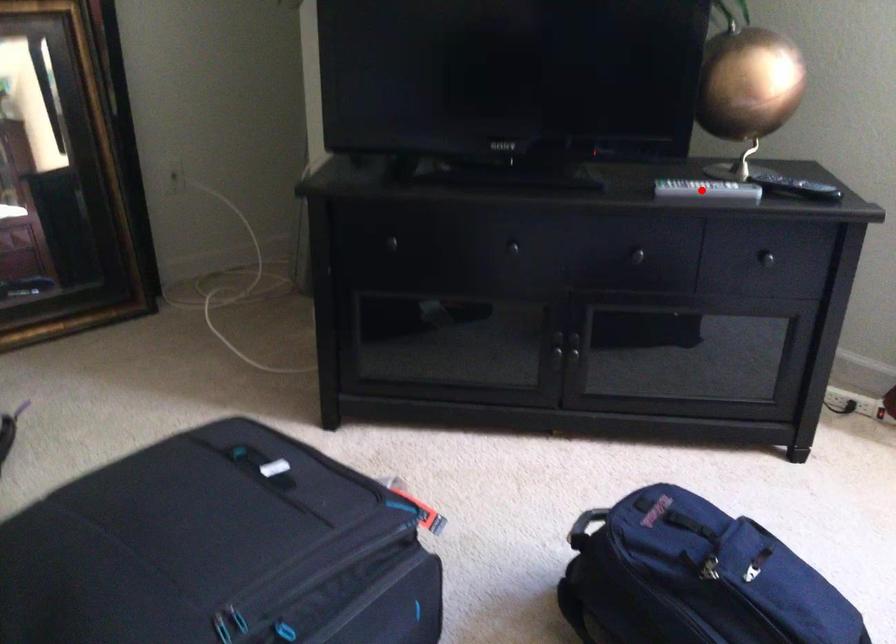
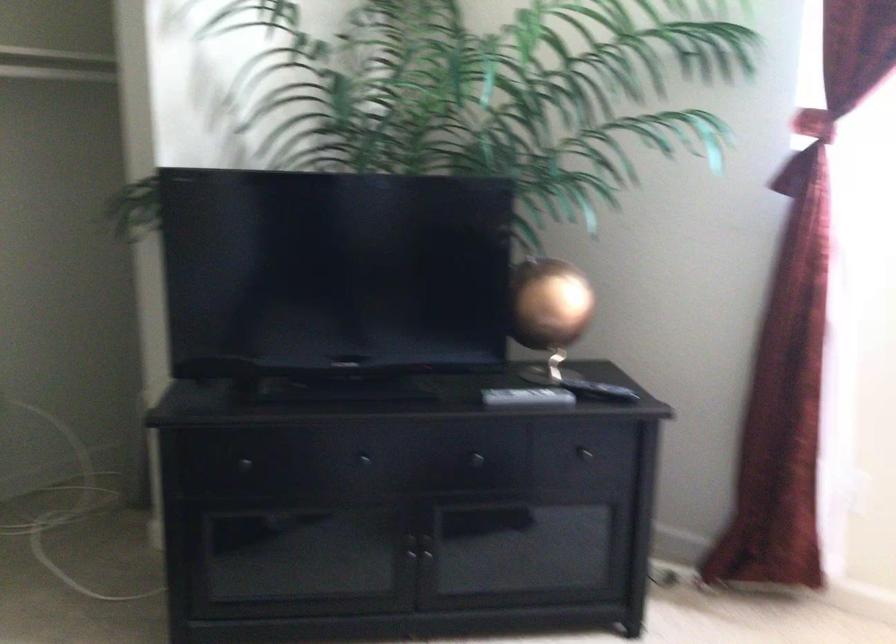
Question: I am providing you with two images of the same scene from different viewpoints. Image1 has a red point marked. In image2, the corresponding 3D location appears at what relative position? Reply with the corresponding letter.

Choices:
 (A) Closer
 (B) Farther

Answer: (B)